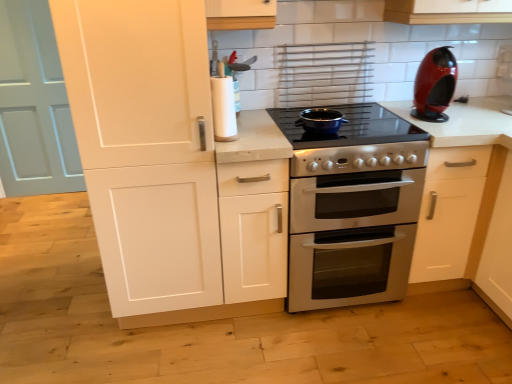
Locate an element on the screen. This screenshot has width=512, height=384. light blue wood door at left is located at coordinates (34, 105).

Measure the distance between point [448,111] and camera.

The depth of point [448,111] is 6.71 feet.

What do you see at coordinates (472, 202) in the screenshot?
I see `smooth white countertop at center` at bounding box center [472, 202].

What is the approximate width of matte black pot at center?

matte black pot at center is 7.68 inches in width.

This screenshot has width=512, height=384. I want to click on light blue wood door at left, so click(34, 105).

Is matte black pot at center closer to camera compared to light blue wood door at left?

Yes, the depth of matte black pot at center is less than that of light blue wood door at left.

Between matte black pot at center and light blue wood door at left, which one has less height?

matte black pot at center is shorter.

Is matte black pot at center positioned with its back to light blue wood door at left?

That's not correct — matte black pot at center is not looking away from light blue wood door at left.

From the image's perspective, is matte black pot at center positioned above or below light blue wood door at left?

From the image's perspective, matte black pot at center appears below light blue wood door at left.

Consider the image. Is glossy plastic coffee machine at upper right positioned with its back to white matte cabinet at left?

No, glossy plastic coffee machine at upper right is not facing the opposite direction of white matte cabinet at left.

Between glossy plastic coffee machine at upper right and white matte cabinet at left, which one has less height?

glossy plastic coffee machine at upper right is shorter.

Is glossy plastic coffee machine at upper right bigger than white matte cabinet at left?

No, glossy plastic coffee machine at upper right is not bigger than white matte cabinet at left.

From a real-world perspective, relative to white matte cabinet at left, is glossy plastic coffee machine at upper right vertically above or below?

Clearly, from a real-world perspective, glossy plastic coffee machine at upper right is above white matte cabinet at left.

How many degrees apart are the facing directions of smooth white countertop at center and white matte cabinet at left?

The angle between the facing direction of smooth white countertop at center and the facing direction of white matte cabinet at left is 0.00301 degrees.

From a real-world perspective, is smooth white countertop at center under white matte cabinet at left?

Correct, in the physical world, smooth white countertop at center is lower than white matte cabinet at left.

From the image's perspective, which is below, smooth white countertop at center or white matte cabinet at left?

smooth white countertop at center.

Is point (418, 249) positioned before point (136, 268)?

No, (418, 249) is behind (136, 268).

Looking at this image, are matte black pot at center and white matte cabinet at left located far from each other?

matte black pot at center is actually quite close to white matte cabinet at left.

How far apart are matte black pot at center and white matte cabinet at left?

matte black pot at center is 29.50 inches from white matte cabinet at left.

Between matte black pot at center and white matte cabinet at left, which one is positioned in front?

white matte cabinet at left is more forward.

Considering the relative sizes of matte black pot at center and white matte cabinet at left in the image provided, is matte black pot at center wider than white matte cabinet at left?

No, matte black pot at center is not wider than white matte cabinet at left.

Can smooth white countertop at center be found inside matte black pot at center?

That's incorrect, smooth white countertop at center is not inside matte black pot at center.

What's the angular difference between matte black pot at center and smooth white countertop at center's facing directions?

There is a 0.000246-degree angle between the facing directions of matte black pot at center and smooth white countertop at center.

Are matte black pot at center and smooth white countertop at center making contact?

No, matte black pot at center is not next to smooth white countertop at center.

Locate an element on the screen. appliance located on the left of smooth white countertop at center is located at coordinates (320, 121).

Is point (451, 143) behind point (318, 115)?

That is False.

Based on the photo, from a real-world perspective, is smooth white countertop at center located beneath matte black pot at center?

Indeed, from a real-world perspective, smooth white countertop at center is positioned beneath matte black pot at center.

Is smooth white countertop at center to the left of matte black pot at center from the viewer's perspective?

No.

Can you confirm if smooth white countertop at center is smaller than glossy plastic coffee machine at upper right?

No.

Image resolution: width=512 pixels, height=384 pixels. I want to click on countertop that appears below the glossy plastic coffee machine at upper right (from the image's perspective), so [x=472, y=202].

Can glossy plastic coffee machine at upper right be found inside smooth white countertop at center?

No.

Can you confirm if smooth white countertop at center is taller than glossy plastic coffee machine at upper right?

Correct, smooth white countertop at center is much taller as glossy plastic coffee machine at upper right.

Locate an element on the screen. This screenshot has width=512, height=384. appliance above the light blue wood door at left (from a real-world perspective) is located at coordinates (320, 121).

Where is `kitchen appliance located behind the white matte cabinet at left`? kitchen appliance located behind the white matte cabinet at left is located at coordinates (435, 85).

Which object lies further to the anchor point smooth white countertop at center, white matte cabinet at left or light blue wood door at left?

light blue wood door at left is positioned further to the anchor smooth white countertop at center.

Estimate the real-world distances between objects in this image. Which object is further from glossy plastic coffee machine at upper right, smooth white countertop at center or light blue wood door at left?

Based on the image, light blue wood door at left appears to be further to glossy plastic coffee machine at upper right.

Looking at this image, looking at the image, which one is located further to white matte cabinet at left, smooth white countertop at center or light blue wood door at left?

light blue wood door at left.

From the image, which object appears to be farther from glossy plastic coffee machine at upper right, light blue wood door at left or white matte cabinet at left?

Based on the image, light blue wood door at left appears to be further to glossy plastic coffee machine at upper right.

Based on their spatial positions, is smooth white countertop at center or glossy plastic coffee machine at upper right closer to white matte cabinet at left?

smooth white countertop at center is closer to white matte cabinet at left.

Which object lies nearer to the anchor point white matte cabinet at left, glossy plastic coffee machine at upper right or light blue wood door at left?

Among the two, glossy plastic coffee machine at upper right is located nearer to white matte cabinet at left.

Estimate the real-world distances between objects in this image. Which object is closer to smooth white countertop at center, glossy plastic coffee machine at upper right or white matte cabinet at left?

Among the two, glossy plastic coffee machine at upper right is located nearer to smooth white countertop at center.

Considering their positions, is glossy plastic coffee machine at upper right positioned further to light blue wood door at left than white matte cabinet at left?

The object further to light blue wood door at left is glossy plastic coffee machine at upper right.

The image size is (512, 384). Identify the location of appliance between white matte cabinet at left and glossy plastic coffee machine at upper right. (320, 121).

In order to click on cabinetry between light blue wood door at left and smooth white countertop at center in this screenshot , I will do `click(149, 156)`.

Identify the location of appliance between light blue wood door at left and glossy plastic coffee machine at upper right in the horizontal direction. The width and height of the screenshot is (512, 384). tap(320, 121).

Find the location of a particular element. This screenshot has height=384, width=512. appliance between glossy plastic coffee machine at upper right and smooth white countertop at center in the up-down direction is located at coordinates (320, 121).